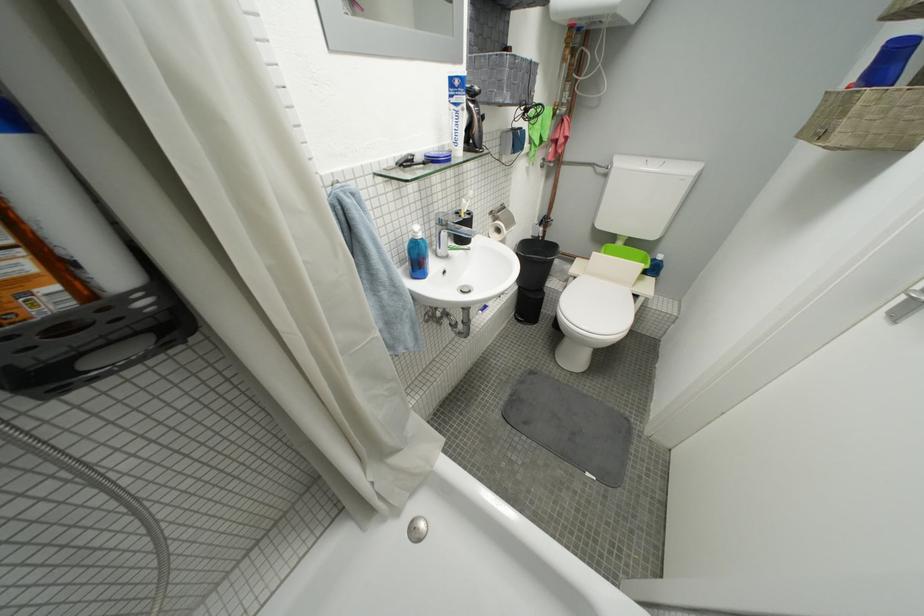
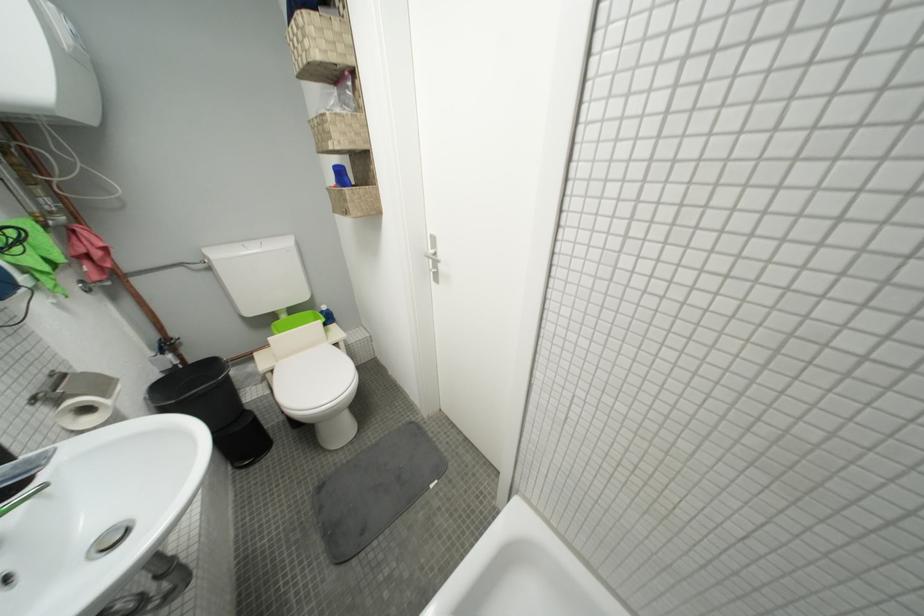
Question: I am providing you with two images of the same scene from different viewpoints. Please identify which objects are invisible in image2.

Choices:
 (A) silver faucet handle
 (B) toilet flush button
 (C) wicker storage basket
 (D) none of these

Answer: (D)